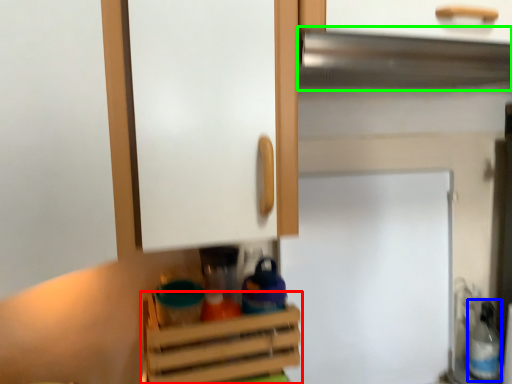
Question: Based on their relative distances, which object is nearer to cabinetry (highlighted by a red box)? Choose from bottle (highlighted by a blue box) and exhaust hood (highlighted by a green box).

Choices:
 (A) bottle
 (B) exhaust hood

Answer: (B)